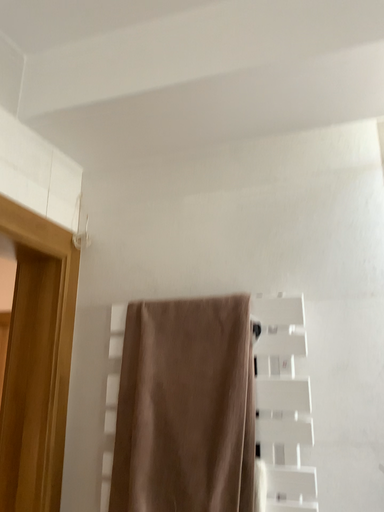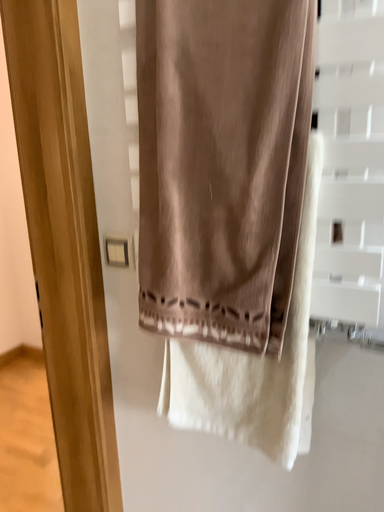
Question: Which way did the camera rotate in the video?

Choices:
 (A) rotated downward
 (B) rotated upward

Answer: (A)